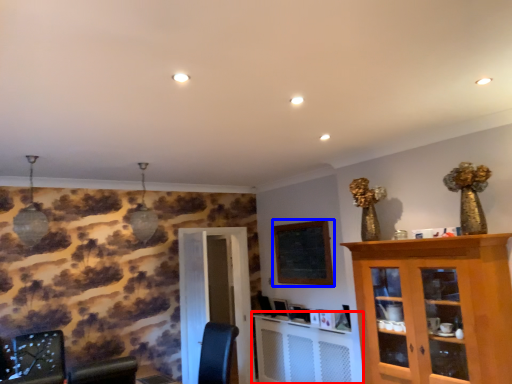
Question: Which of the following is the closest to the observer, computer desk (highlighted by a red box) or bulletin board (highlighted by a blue box)?

Choices:
 (A) computer desk
 (B) bulletin board

Answer: (A)